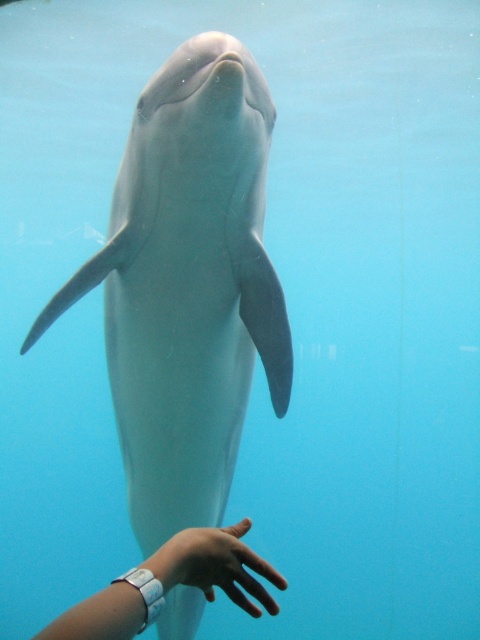
You are a marine biologist observing the dolphin and the human interaction. From your viewpoint, is the white rubber watch at lower center located above or below the smooth skin hand at center?

The white rubber watch at lower center is below the smooth skin hand at center.

You are a marine biologist observing the underwater scene. You notice the smooth gray dolphin at center and the smooth skin hand at center. Which object is closer to you, the observer?

The smooth gray dolphin at center is closer to you than the smooth skin hand at center because it is positioned further to the viewer in the scene.

You are a marine biologist observing the dolphin and the hand in the underwater scene. You notice two points marked in the image. Which point is closer to you, point (164, 308) or point (250, 576)?

Point (164, 308) is further to the viewer than point (250, 576). Wait, the question is which is closer. Hmm, the description says point A is further to the viewer than point B. So the closer one would be point B. Let me check the question again. The user is asking which is closer to the observer. Since point A is further away, then point B is closer. So the answer should state that point (250, 576) is closer. But the description says point A is further to the viewer than B. Wait, the wording might be